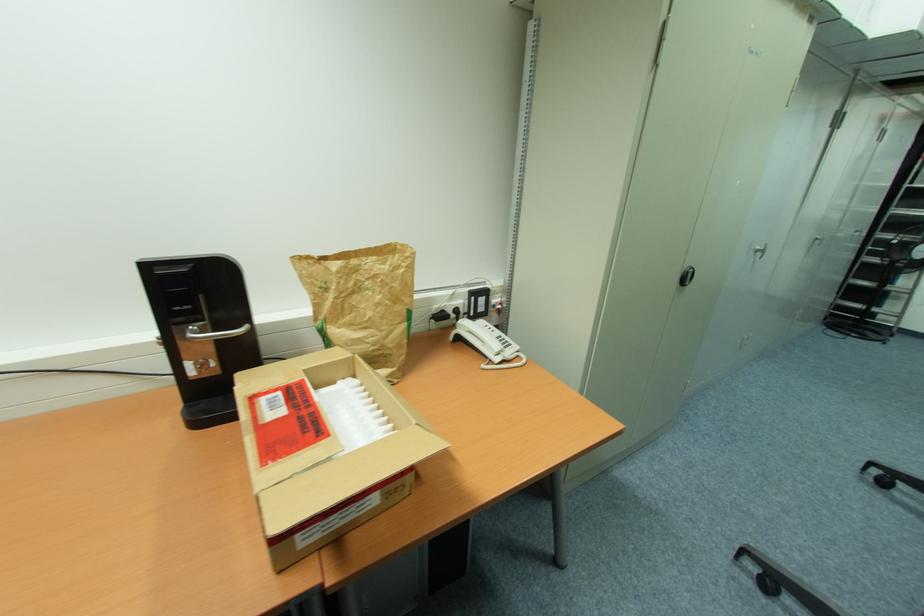
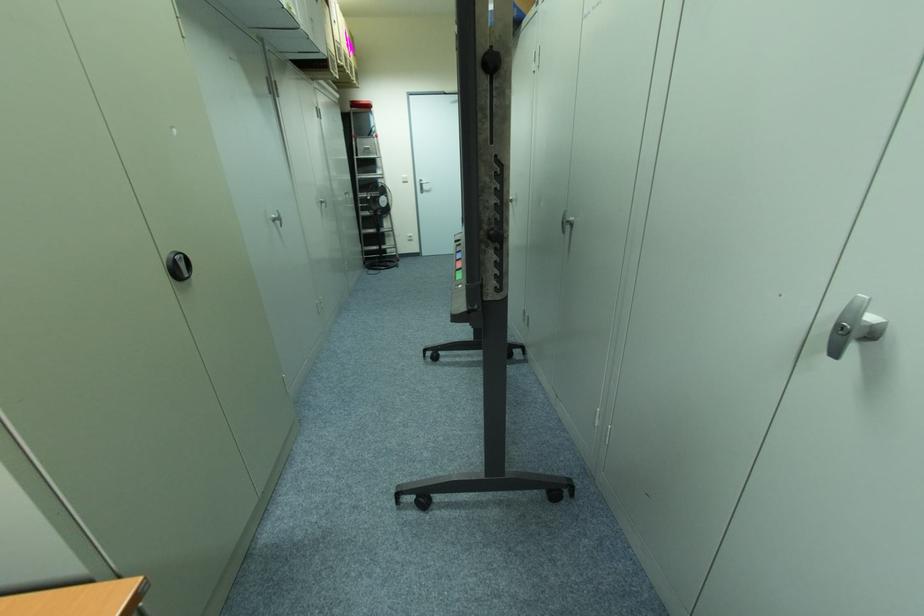
Find the pixel in the second image that matches (817,240) in the first image.

(322, 203)